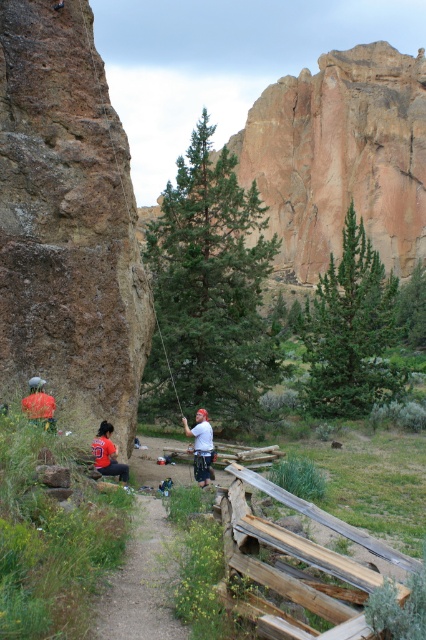
Question: Among these points, which one is farthest from the camera?

Choices:
 (A) (357, 269)
 (B) (111, 451)

Answer: (A)

Question: Is green needle-like pine at center bigger than red fabric person at lower left?

Choices:
 (A) no
 (B) yes

Answer: (B)

Question: Which object is closer to the camera taking this photo?

Choices:
 (A) green textured pine tree at center
 (B) red fabric person at lower left
 (C) white cotton shirt at center
 (D) brown rough rock at left

Answer: (B)

Question: Is dirt path at center wider than orange t-shirt at lower left?

Choices:
 (A) yes
 (B) no

Answer: (A)

Question: Is green textured pine tree at center to the left of orange t-shirt at lower left from the viewer's perspective?

Choices:
 (A) yes
 (B) no

Answer: (B)

Question: Estimate the real-world distances between objects in this image. Which object is closer to the green textured pine tree at center?

Choices:
 (A) orange t-shirt at lower left
 (B) red fabric person at lower left
 (C) brown rough rock at left
 (D) dirt path at center

Answer: (C)